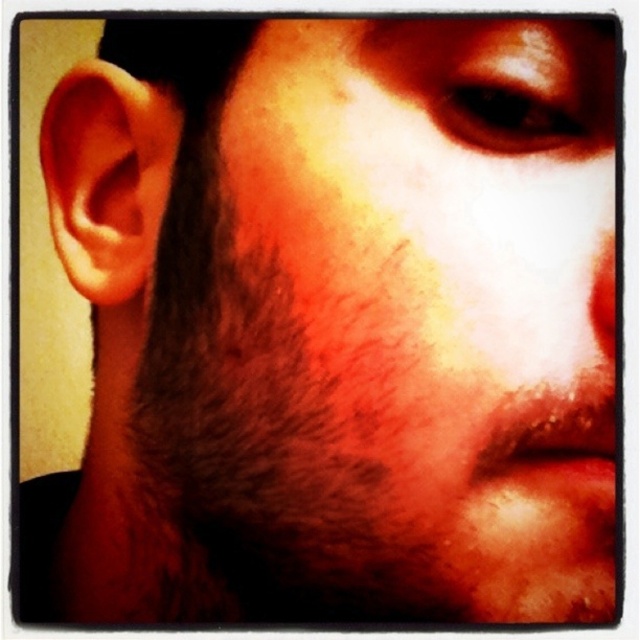
Question: Among these objects, which one is nearest to the camera?

Choices:
 (A) dark brown fuzzy beard at left
 (B) brown matte eye at upper center
 (C) matte red nose at center

Answer: (B)

Question: Among these objects, which one is farthest from the camera?

Choices:
 (A) matte red nose at center
 (B) dark brown fuzzy beard at left
 (C) brown matte eye at upper center

Answer: (A)

Question: Does dark brown fuzzy beard at left have a smaller size compared to matte red nose at center?

Choices:
 (A) yes
 (B) no

Answer: (B)

Question: Which point is farther to the camera?

Choices:
 (A) matte red nose at center
 (B) dark brown fuzzy beard at left
 (C) brown matte eye at upper center

Answer: (A)

Question: Is dark brown fuzzy beard at left wider than matte red nose at center?

Choices:
 (A) no
 (B) yes

Answer: (B)

Question: From the image, what is the correct spatial relationship of brown matte eye at upper center in relation to matte red nose at center?

Choices:
 (A) right
 (B) left

Answer: (B)